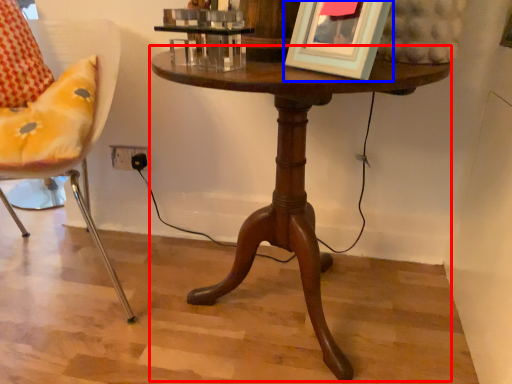
Question: Among these objects, which one is nearest to the camera, table (highlighted by a red box) or picture frame (highlighted by a blue box)?

Choices:
 (A) table
 (B) picture frame

Answer: (B)